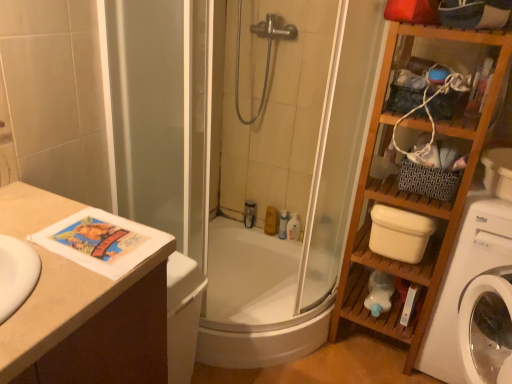
Question: From the image's perspective, is translucent plastic bottle at upper center, the 1th toiletry viewed from the left, below wooden shelf at right?

Choices:
 (A) yes
 (B) no

Answer: (A)

Question: Does translucent plastic bottle at upper center, the 1th toiletry viewed from the left, have a smaller size compared to wooden shelf at right?

Choices:
 (A) no
 (B) yes

Answer: (B)

Question: Does translucent plastic bottle at upper center, the 4th toiletry viewed from the right, come in front of wooden shelf at right?

Choices:
 (A) no
 (B) yes

Answer: (A)

Question: Can you see translucent plastic bottle at upper center, the 4th toiletry viewed from the right, touching wooden shelf at right?

Choices:
 (A) yes
 (B) no

Answer: (B)

Question: Could you tell me if translucent plastic bottle at upper center, the 4th toiletry viewed from the right, is facing wooden shelf at right?

Choices:
 (A) yes
 (B) no

Answer: (B)

Question: Is white plastic bottle at center, placed as the fourth toiletry when sorted from left to right, taller or shorter than wooden shelf at right?

Choices:
 (A) tall
 (B) short

Answer: (B)

Question: Considering their positions, is white plastic bottle at center, placed as the fourth toiletry when sorted from left to right, located in front of or behind wooden shelf at right?

Choices:
 (A) front
 (B) behind

Answer: (B)

Question: From a real-world perspective, is white plastic bottle at center, placed as the fourth toiletry when sorted from left to right, physically located above or below wooden shelf at right?

Choices:
 (A) below
 (B) above

Answer: (A)

Question: Is white plastic bottle at center, placed as the 1th toiletry when sorted from right to left, wider or thinner than wooden shelf at right?

Choices:
 (A) thin
 (B) wide

Answer: (A)

Question: Is silver metallic showerhead at upper center bigger or smaller than wooden shelf at right?

Choices:
 (A) big
 (B) small

Answer: (B)

Question: From a real-world perspective, is silver metallic showerhead at upper center positioned above or below wooden shelf at right?

Choices:
 (A) above
 (B) below

Answer: (A)

Question: Would you say silver metallic showerhead at upper center is to the left or to the right of wooden shelf at right in the picture?

Choices:
 (A) right
 (B) left

Answer: (B)

Question: From their relative heights in the image, would you say silver metallic showerhead at upper center is taller or shorter than wooden shelf at right?

Choices:
 (A) short
 (B) tall

Answer: (A)

Question: Is translucent plastic bottle at upper center, the 1th toiletry viewed from the left, in front of or behind white plastic washing machine at right in the image?

Choices:
 (A) front
 (B) behind

Answer: (B)

Question: From a real-world perspective, relative to white plastic washing machine at right, is translucent plastic bottle at upper center, the 1th toiletry viewed from the left, vertically above or below?

Choices:
 (A) below
 (B) above

Answer: (A)